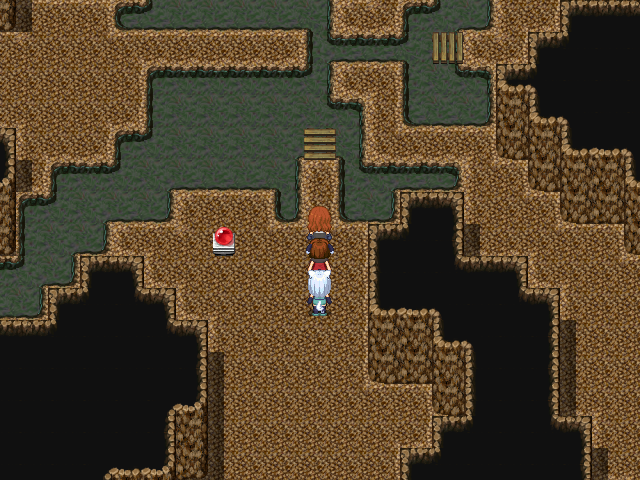
The image size is (640, 480). Identify the location of stairs. (317, 143), (452, 42).